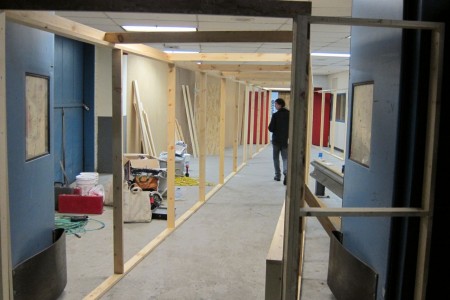
Identify the location of floor. (236, 225), (95, 253), (138, 233), (315, 245).